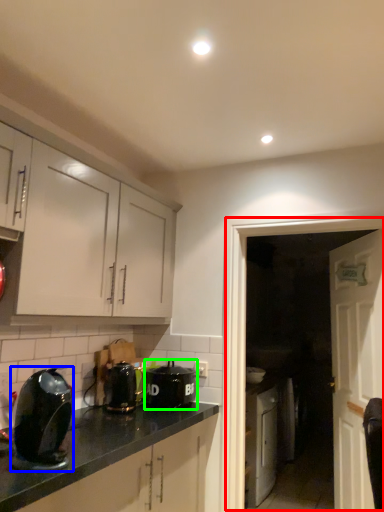
Question: Which object is positioned farthest from glass door (highlighted by a red box)? Select from kitchen appliance (highlighted by a blue box) and kitchen appliance (highlighted by a green box).

Choices:
 (A) kitchen appliance
 (B) kitchen appliance

Answer: (A)